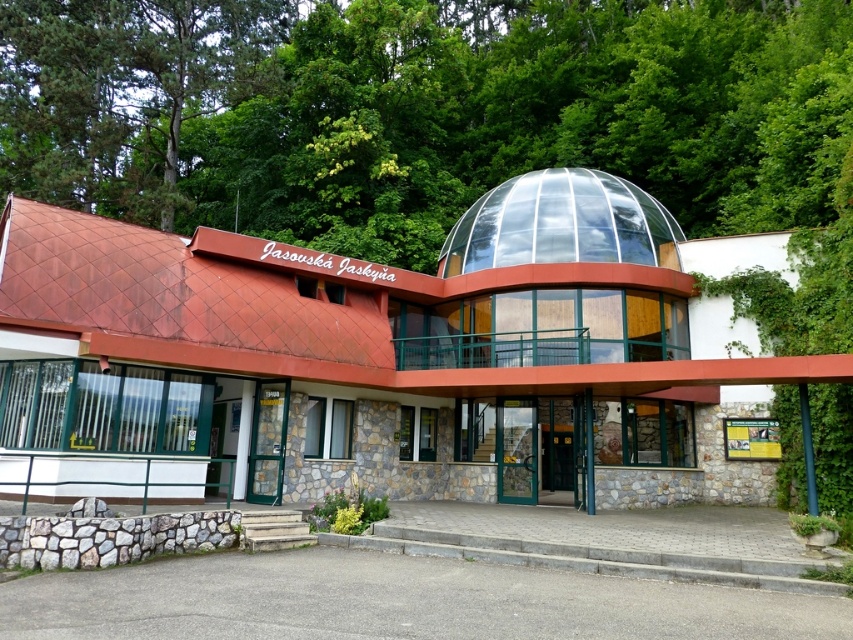
Question: Is green leafy tree at upper center above green glass door at center?

Choices:
 (A) yes
 (B) no

Answer: (A)

Question: Can you confirm if green leafy tree at upper center is positioned to the right of transparent glass dome at center?

Choices:
 (A) yes
 (B) no

Answer: (B)

Question: Which object is farther from the camera taking this photo?

Choices:
 (A) green glass door at center
 (B) transparent glass dome at center

Answer: (B)

Question: Is green leafy tree at upper center bigger than green glass door at center?

Choices:
 (A) no
 (B) yes

Answer: (B)

Question: Estimate the real-world distances between objects in this image. Which object is farther from the green leafy tree at upper center?

Choices:
 (A) green glass door at center
 (B) transparent glass dome at center

Answer: (A)

Question: Which object appears farthest from the camera in this image?

Choices:
 (A) transparent glass dome at center
 (B) green glass door at center
 (C) green leafy tree at upper center

Answer: (C)